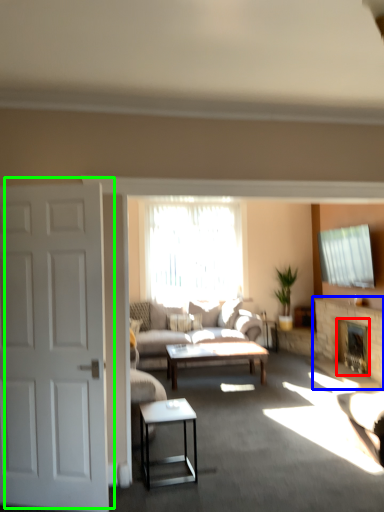
Question: Considering the real-world distances, which object is closest to fireplace (highlighted by a red box)? fireplace (highlighted by a blue box) or door (highlighted by a green box).

Choices:
 (A) fireplace
 (B) door

Answer: (A)